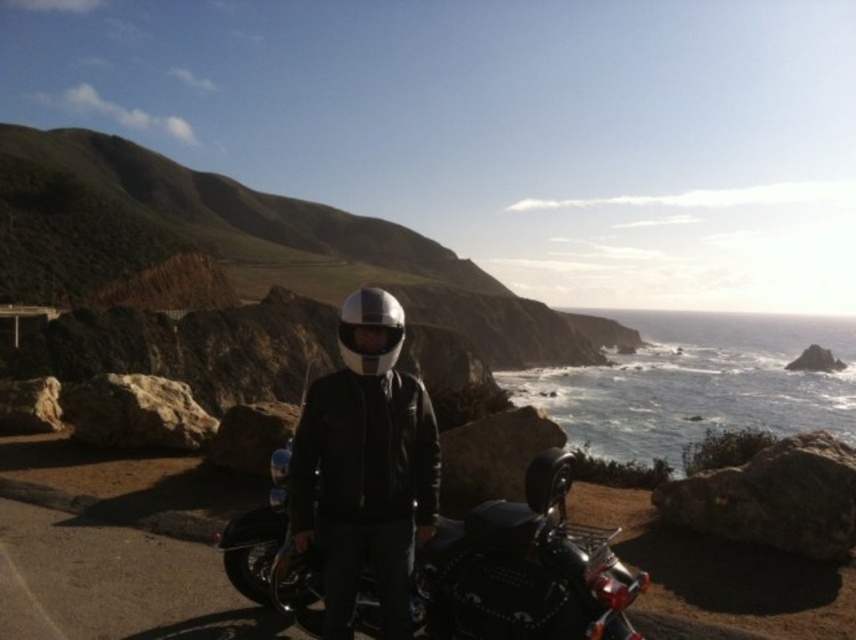
Who is lower down, shiny chrome motorcycle at center or glossy metallic helmet at center?

shiny chrome motorcycle at center is lower down.

Between shiny chrome motorcycle at center and glossy metallic helmet at center, which one has less height?

→ shiny chrome motorcycle at center is shorter.

Who is more forward, (318, 625) or (361, 355)?

Point (361, 355) is in front.

The width and height of the screenshot is (856, 640). I want to click on shiny chrome motorcycle at center, so click(522, 570).

Is point (284, 531) farther from camera compared to point (397, 556)?

Yes, point (284, 531) is farther from viewer.

Where is `shiny chrome motorcycle at center`? Image resolution: width=856 pixels, height=640 pixels. shiny chrome motorcycle at center is located at coordinates (522, 570).

The width and height of the screenshot is (856, 640). Find the location of `shiny chrome motorcycle at center`. shiny chrome motorcycle at center is located at coordinates (522, 570).

Is shiny black helmet at center to the right of glossy metallic helmet at center from the viewer's perspective?

Correct, you'll find shiny black helmet at center to the right of glossy metallic helmet at center.

The height and width of the screenshot is (640, 856). I want to click on shiny black helmet at center, so click(366, 467).

What do you see at coordinates (366, 467) in the screenshot? The width and height of the screenshot is (856, 640). I see `shiny black helmet at center` at bounding box center [366, 467].

The image size is (856, 640). What are the coordinates of `shiny black helmet at center` in the screenshot? It's located at (366, 467).